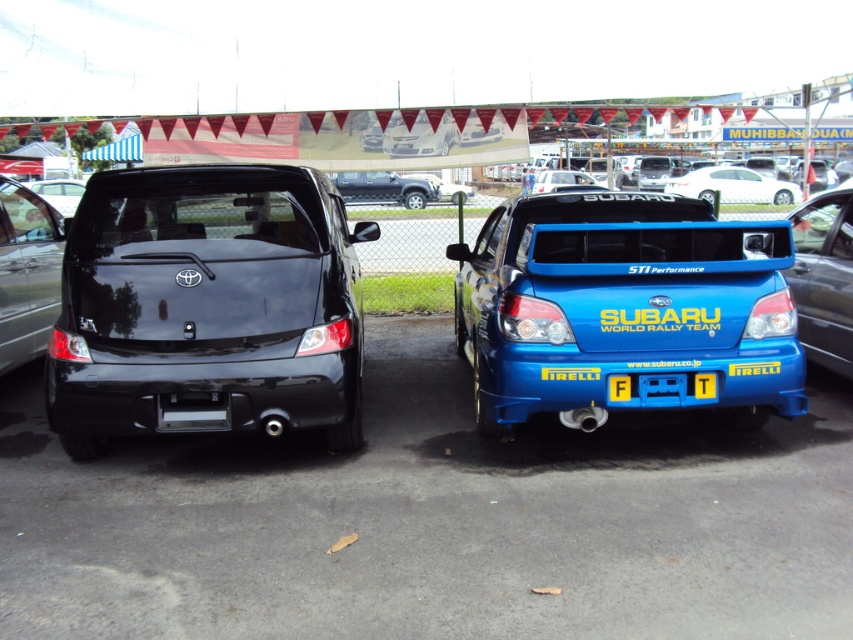
Is blue glossy sedan at right bigger than matte black truck at center?

No, blue glossy sedan at right is not bigger than matte black truck at center.

At what (x,y) coordinates should I click in order to perform the action: click on blue glossy sedan at right. Please return your answer as a coordinate pair (x, y). The width and height of the screenshot is (853, 640). Looking at the image, I should click on (622, 307).

Does black glossy minivan at left have a greater width compared to blue glossy sedan at right?

No.

Between point (234, 326) and point (795, 369), which one is positioned in front?

Point (234, 326)

This screenshot has height=640, width=853. What are the coordinates of `black glossy minivan at left` in the screenshot? It's located at (207, 307).

The width and height of the screenshot is (853, 640). I want to click on blue metallic sedan at right, so click(x=824, y=276).

Does blue metallic sedan at right have a greater width compared to yellow plastic license plate at center?

Yes, blue metallic sedan at right is wider than yellow plastic license plate at center.

Where is `blue metallic sedan at right`? blue metallic sedan at right is located at coordinates (824, 276).